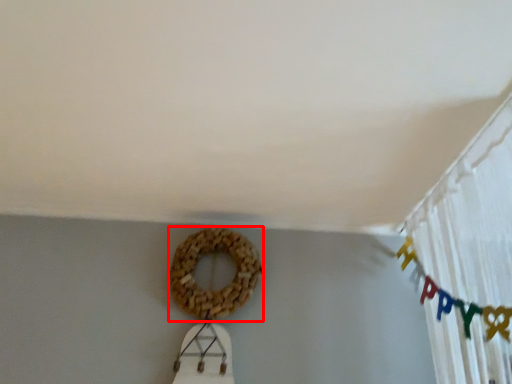
Question: From the image's perspective, what is the correct spatial positioning of bagel (annotated by the red box) in reference to curtain?

Choices:
 (A) above
 (B) below

Answer: (B)